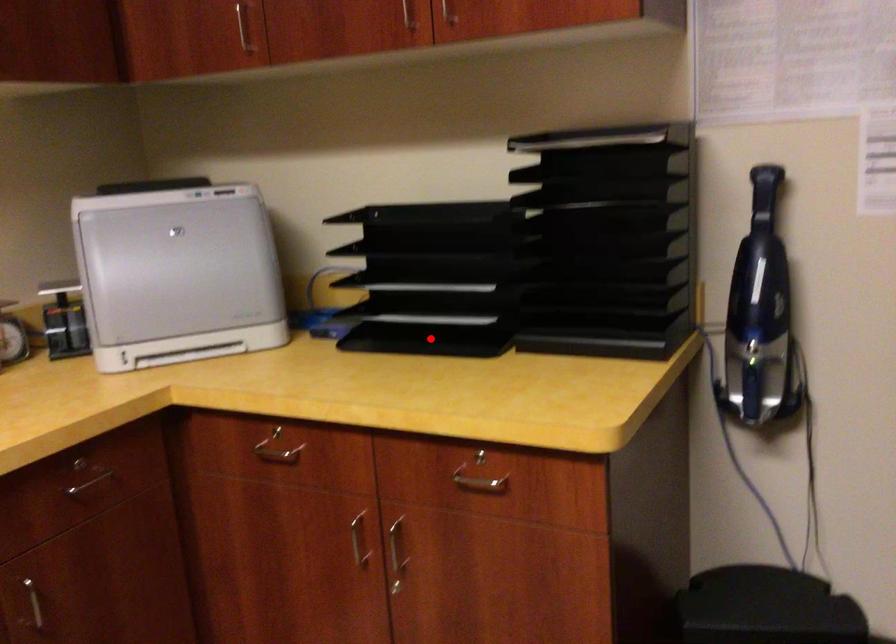
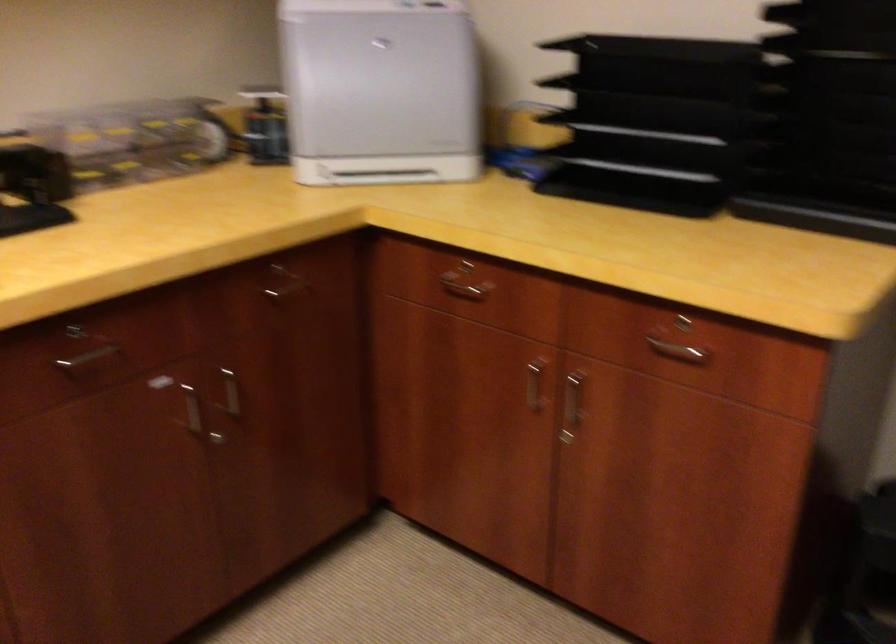
Question: I am providing you with two images of the same scene from different viewpoints. A red point is marked on the first image. Is the red point's position out of view in image 2?

Choices:
 (A) Yes
 (B) No

Answer: (B)